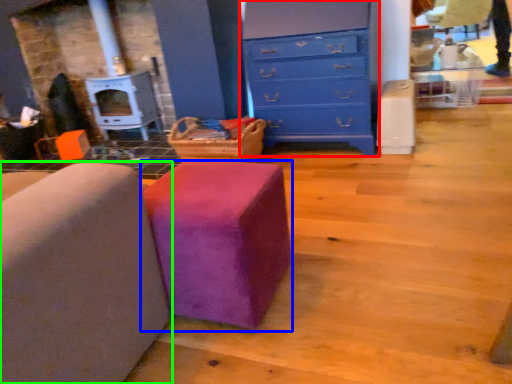
Question: Which object is positioned farthest from chest of drawers (highlighted by a red box)? Select from furniture (highlighted by a blue box) and furniture (highlighted by a green box).

Choices:
 (A) furniture
 (B) furniture

Answer: (B)